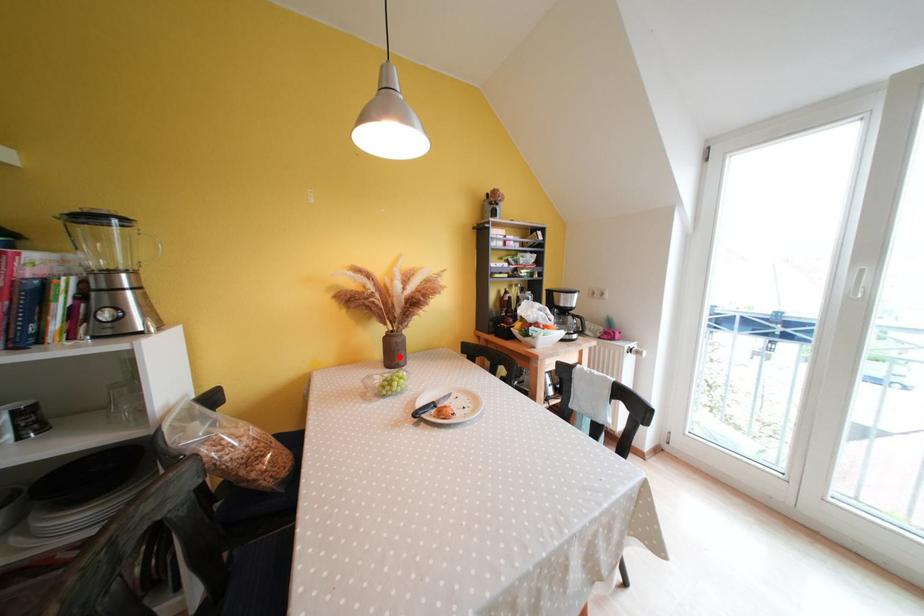
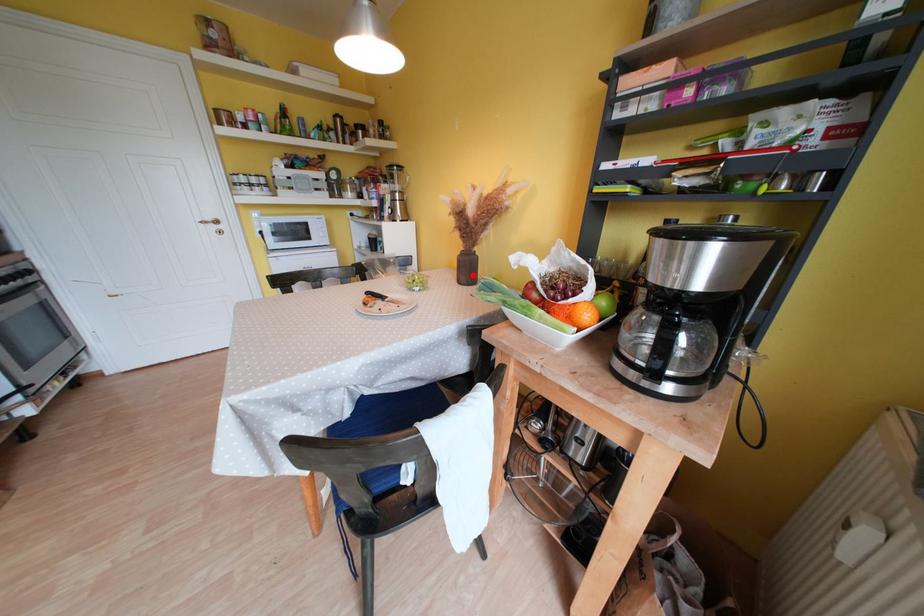
I am providing you with two images of the same scene from different viewpoints. A red point is marked on the first image and another point is marked on the second image. Does the point marked in image1 correspond to the same location as the one in image2?

Yes